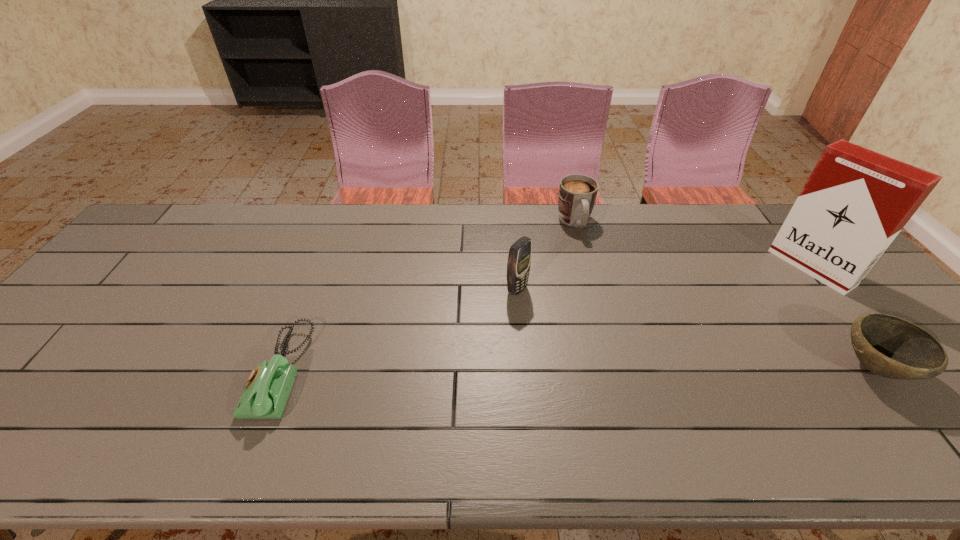
The height and width of the screenshot is (540, 960). I want to click on unoccupied area between the second tallest object and the third tallest object, so click(x=546, y=256).

At what (x,y) coordinates should I click in order to perform the action: click on free space between the third object from right to left and the tallest object. Please return your answer as a coordinate pair (x, y). The height and width of the screenshot is (540, 960). Looking at the image, I should click on tap(693, 245).

Where is `free space between the shortest object and the cigarette_case`? The width and height of the screenshot is (960, 540). free space between the shortest object and the cigarette_case is located at coordinates (546, 320).

What are the coordinates of `object that stands as the third closest to the third shortest object` in the screenshot? It's located at (888, 346).

Select which object is the second closest to the bowl. Please provide its 2D coordinates. Your answer should be formatted as a tuple, i.e. [(x, y)], where the tuple contains the x and y coordinates of a point satisfying the conditions above.

[(577, 193)]

This screenshot has height=540, width=960. Identify the location of vacant area in the image that satisfies the following two spatial constraints: 1. on the front side of the fourth object from right to left; 2. on the right side of the second shortest object. (524, 368).